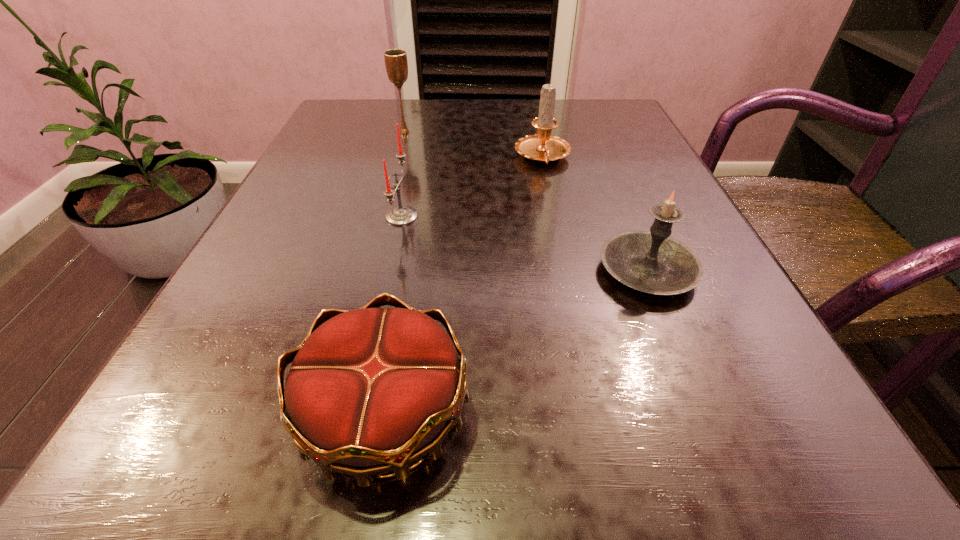
Find the location of a particular element. This screenshot has height=540, width=960. vacant space at the right edge of the desktop is located at coordinates (759, 321).

Where is `vacant area at the far left corner`? vacant area at the far left corner is located at coordinates (387, 123).

The height and width of the screenshot is (540, 960). I want to click on vacant space at the near left corner of the desktop, so click(172, 512).

This screenshot has height=540, width=960. In the image, there is a desktop. Identify the location of vacant area at the far right corner. (605, 126).

The height and width of the screenshot is (540, 960). In order to click on free space between the fourth nearest object and the shortest object in this screenshot , I will do `click(464, 286)`.

Locate an element on the screen. vacant area that lies between the chalice and the crown is located at coordinates (395, 273).

Locate an element on the screen. This screenshot has height=540, width=960. empty space that is in between the farthest candle and the chalice is located at coordinates (473, 145).

Where is `object that is the fourth closest to the farthest object`? This screenshot has height=540, width=960. object that is the fourth closest to the farthest object is located at coordinates (371, 390).

Locate which object ranks second in proximity to the farthest object. Please provide its 2D coordinates. Your answer should be formatted as a tuple, i.e. [(x, y)], where the tuple contains the x and y coordinates of a point satisfying the conditions above.

[(401, 215)]

Locate an element on the screen. candle that is the closest to the nearest object is located at coordinates (652, 262).